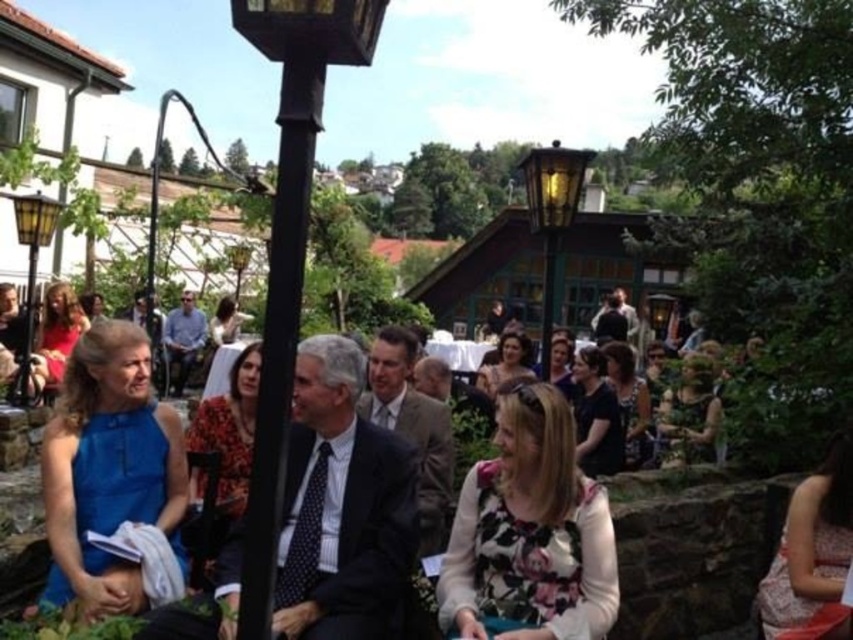
Which is more to the right, black metal lamp post at center or matte black lamp post at center?

From the viewer's perspective, matte black lamp post at center appears more on the right side.

Which is more to the left, black metal lamp post at center or matte black lamp post at center?

black metal lamp post at center is more to the left.

The image size is (853, 640). What do you see at coordinates (288, 243) in the screenshot?
I see `black metal lamp post at center` at bounding box center [288, 243].

Image resolution: width=853 pixels, height=640 pixels. Find the location of `black metal lamp post at center`. black metal lamp post at center is located at coordinates (288, 243).

Does blue satin dress at left appear on the left side of black metal lamp post at center?

In fact, blue satin dress at left is to the right of black metal lamp post at center.

Between blue satin dress at left and black metal lamp post at center, which one is positioned lower?

blue satin dress at left

Does point (131, 476) come farther from viewer compared to point (257, 577)?

Yes.

Identify the location of blue satin dress at left. The image size is (853, 640). (108, 468).

Which is more to the right, matte black lamp post at center or matte yellow lamp post at left?

From the viewer's perspective, matte black lamp post at center appears more on the right side.

Can you confirm if matte black lamp post at center is positioned to the left of matte yellow lamp post at left?

In fact, matte black lamp post at center is to the right of matte yellow lamp post at left.

Does point (566, 221) lie behind point (26, 195)?

No, (566, 221) is closer to viewer.

In order to click on matte black lamp post at center in this screenshot , I will do click(552, 214).